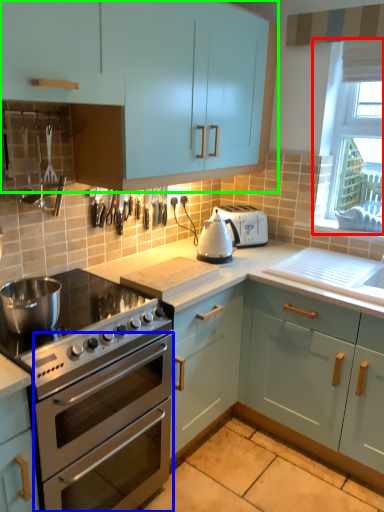
Question: Estimate the real-world distances between objects in this image. Which object is closer to window screen (highlighted by a red box), oven (highlighted by a blue box) or cabinetry (highlighted by a green box)?

Choices:
 (A) oven
 (B) cabinetry

Answer: (B)